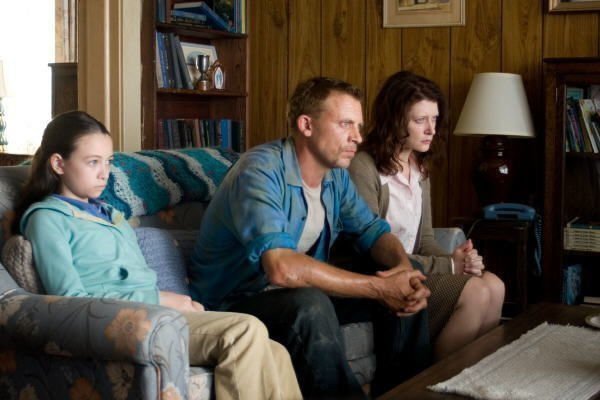
Where is `end table`? This screenshot has height=400, width=600. end table is located at coordinates (506, 230).